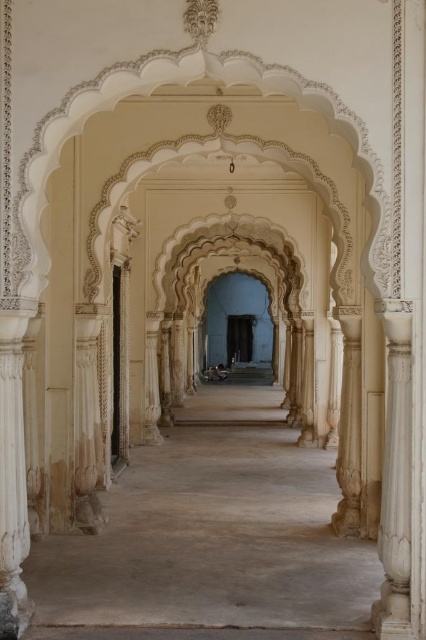
You are an architect designing a new building and want to ensure that the corridor is taller than the supporting columns for aesthetic purposes. Based on the image, would the smooth sandstone corridor at center meet this requirement compared to the white marble column at right?

The smooth sandstone corridor at center is shorter than the white marble column at right, so it does not meet the requirement of being taller than the supporting columns for aesthetic purposes.

You are standing at the entrance of the corridor and want to walk straight ahead. Based on the image, where would you expect to find the smooth sandstone corridor at center relative to your starting position?

The smooth sandstone corridor at center is located at the point 0.833 along the x axis and 0.502 along the y axis, so it is positioned to the right and slightly forward from your starting position at the entrance.

You are standing in the corridor and want to move towards the entrance located behind the white marble column at right. To avoid bumping into the column, which direction should you walk relative to the smooth sandstone corridor at center?

You should walk towards the right side of the smooth sandstone corridor at center, as it is positioned under the white marble column at right, meaning the column is above and to the right of the corridor. Moving to the right side of the corridor would allow you to navigate around the column safely.